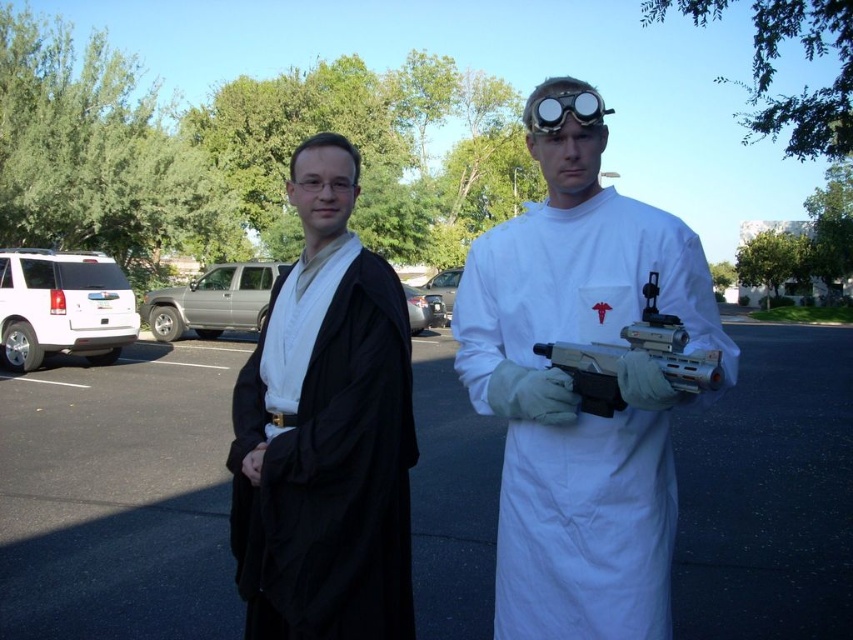
Does matte black robe at center come behind black matte robe at left?

That is False.

Can you confirm if matte black robe at center is positioned to the right of black matte robe at left?

Correct, you'll find matte black robe at center to the right of black matte robe at left.

Is point (695, 240) less distant than point (308, 346)?

Yes.

At what (x,y) coordinates should I click in order to perform the action: click on matte black robe at center. Please return your answer as a coordinate pair (x, y). Looking at the image, I should click on (577, 396).

Looking at this image, is asphalt at center to the left of clear plastic goggles at center from the viewer's perspective?

Yes, asphalt at center is to the left of clear plastic goggles at center.

Can you confirm if asphalt at center is positioned below clear plastic goggles at center?

Yes, asphalt at center is below clear plastic goggles at center.

You are a GUI agent. You are given a task and a screenshot of the screen. Output one action in this format:
    pyautogui.click(x=<x>, y=<y>)
    Task: Click on the asphalt at center
    The image size is (853, 640).
    Given the screenshot: What is the action you would take?
    pyautogui.click(x=119, y=499)

Is black matte robe at left smaller than metallic plastic gun at center?

Actually, black matte robe at left might be larger than metallic plastic gun at center.

How far apart are black matte robe at left and metallic plastic gun at center?

black matte robe at left and metallic plastic gun at center are 31.63 inches apart from each other.

Does point (399, 381) lie in front of point (643, 337)?

No, (399, 381) is further to viewer.

The width and height of the screenshot is (853, 640). In order to click on black matte robe at left in this screenshot , I will do pos(326,458).